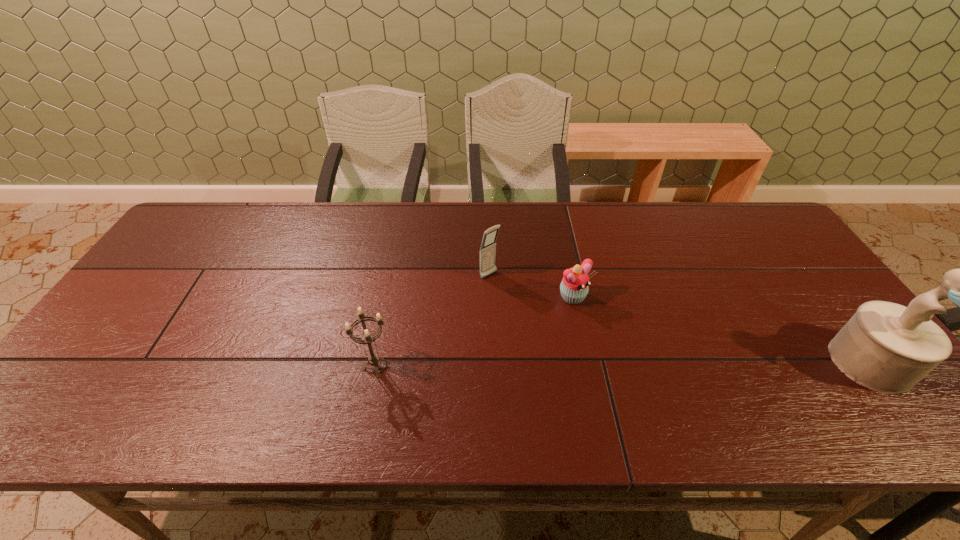
Find the location of a particular element. the leftmost object is located at coordinates [373, 359].

Where is `the rightmost object`? This screenshot has width=960, height=540. the rightmost object is located at coordinates (886, 347).

Find the location of a particular element. The height and width of the screenshot is (540, 960). figurine is located at coordinates (886, 347).

The image size is (960, 540). I want to click on the second object from right to left, so click(x=574, y=287).

Where is `the second farthest object`? Image resolution: width=960 pixels, height=540 pixels. the second farthest object is located at coordinates (574, 287).

Find the location of a particular element. the farthest object is located at coordinates (488, 246).

Where is `cellular telephone`? This screenshot has width=960, height=540. cellular telephone is located at coordinates (488, 246).

In order to click on vacant space situated on the left of the leftmost object in this screenshot , I will do `click(257, 366)`.

Find the location of a particular element. This screenshot has height=540, width=960. vacant point located 0.200m on the face of the cupcake is located at coordinates (644, 360).

What are the coordinates of `free space located on the face of the cupcake` in the screenshot? It's located at (674, 388).